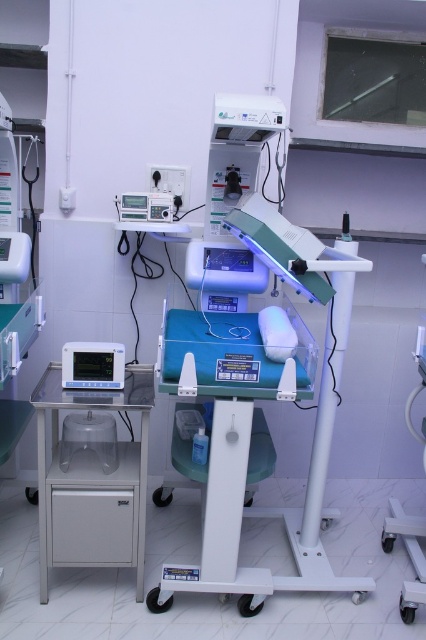
Question: Which object appears farthest from the camera in this image?

Choices:
 (A) metallic gray monitor at left
 (B) blue plastic tray at center

Answer: (A)

Question: Can you confirm if blue plastic tray at center is wider than metallic gray monitor at left?

Choices:
 (A) no
 (B) yes

Answer: (B)

Question: Is blue plastic tray at center bigger than metallic gray monitor at left?

Choices:
 (A) no
 (B) yes

Answer: (B)

Question: Based on their relative distances, which object is farther from the blue plastic tray at center?

Choices:
 (A) matte black monitor at left
 (B) metallic gray monitor at left

Answer: (A)

Question: From the image, what is the correct spatial relationship of blue plastic tray at center in relation to matte black monitor at left?

Choices:
 (A) above
 (B) below

Answer: (B)

Question: Which point is closer to the camera taking this photo?

Choices:
 (A) (48, 529)
 (B) (275, 324)
 (C) (106, 352)

Answer: (A)